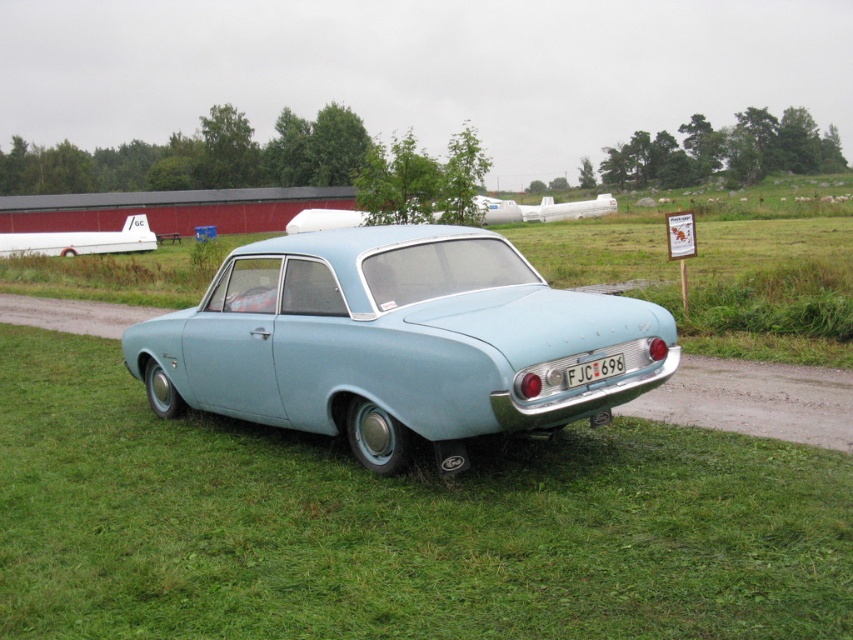
Question: Among these points, which one is farthest from the camera?

Choices:
 (A) (531, 433)
 (B) (595, 358)

Answer: (A)

Question: Can you confirm if light blue matte car at center is positioned to the left of white plastic license plate at center?

Choices:
 (A) yes
 (B) no

Answer: (A)

Question: Is light blue matte car at center above white plastic license plate at center?

Choices:
 (A) yes
 (B) no

Answer: (A)

Question: Can you confirm if light blue matte car at center is smaller than white plastic license plate at center?

Choices:
 (A) no
 (B) yes

Answer: (A)

Question: Among these points, which one is nearest to the camera?

Choices:
 (A) (607, 394)
 (B) (592, 376)

Answer: (A)